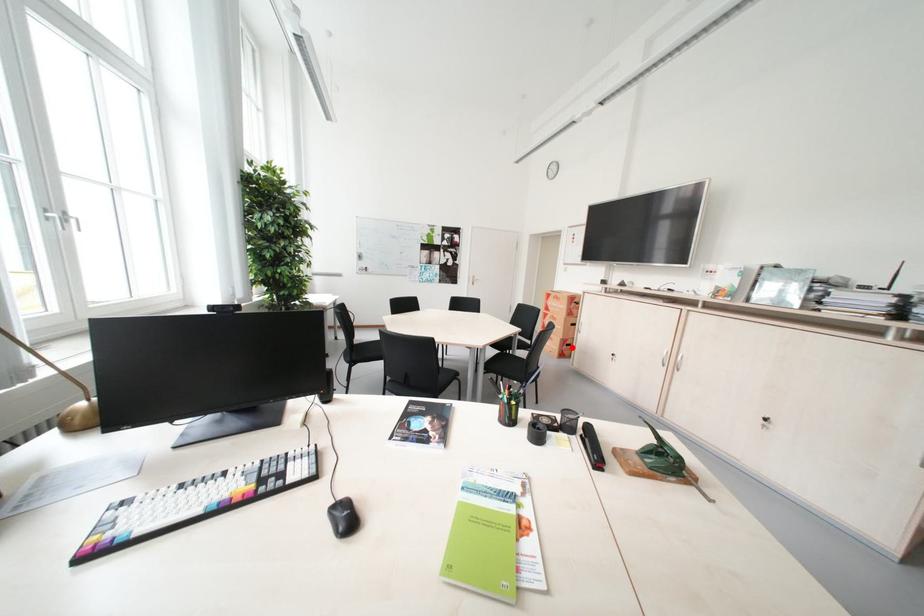
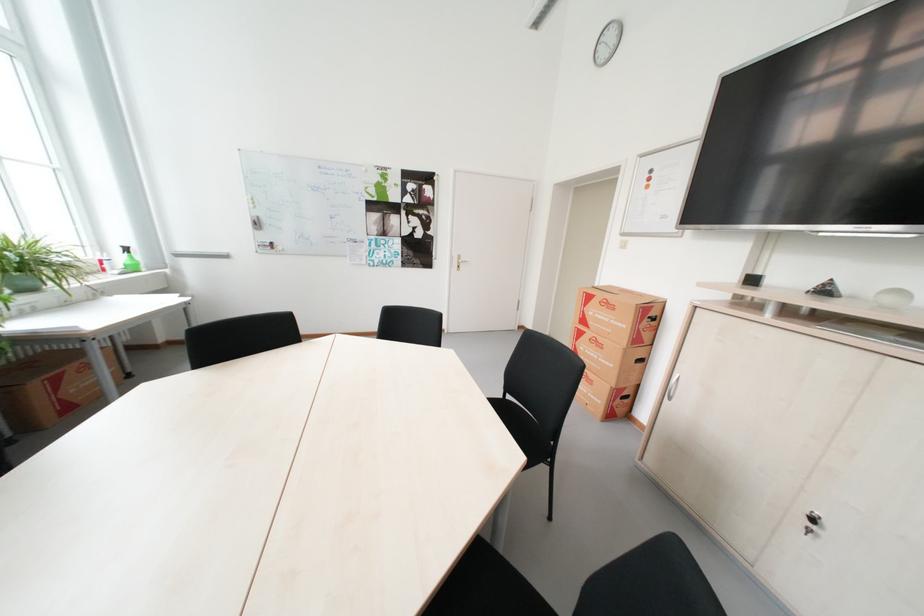
Question: I am providing you with two images of the same scene from different viewpoints. Given a red point in image1, look at the same physical point in image2. Is it:

Choices:
 (A) Closer to the viewpoint
 (B) Farther from the viewpoint

Answer: (A)